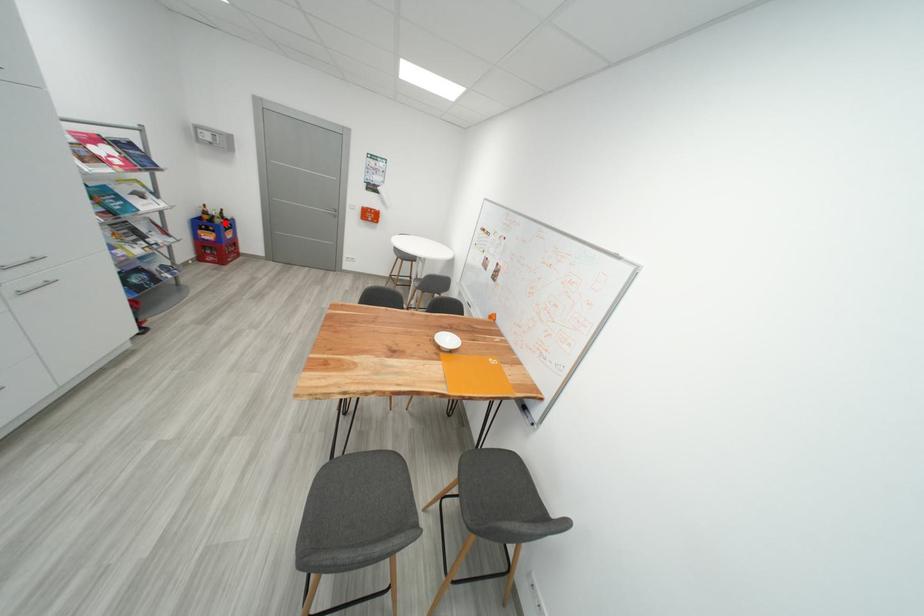
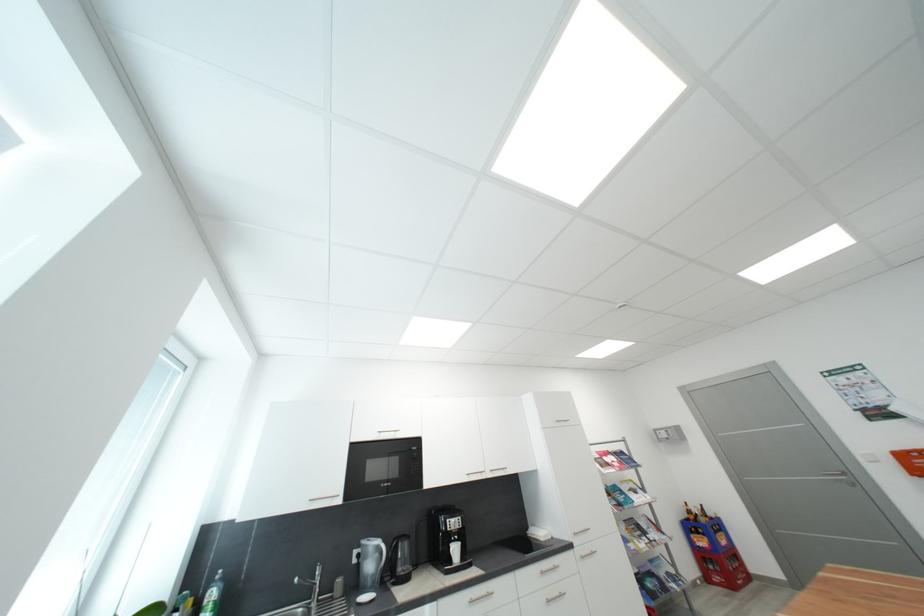
Locate, in the second image, the point that corresponds to the highlighted location in the first image.

(710, 522)